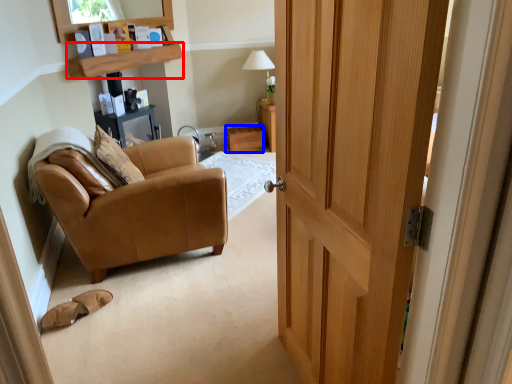
Question: Which object appears closest to the camera in this image, shelf (highlighted by a red box) or drawer (highlighted by a blue box)?

Choices:
 (A) shelf
 (B) drawer

Answer: (A)